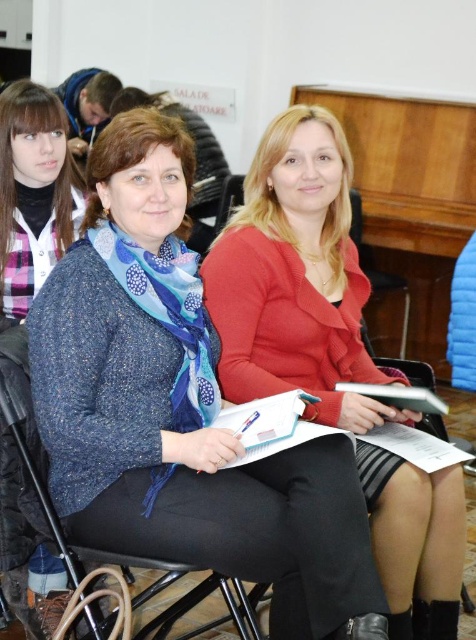
Question: Which is farther from the matte red sweater at center?

Choices:
 (A) blue textured scarf at center
 (B) wooden at center

Answer: (B)

Question: Does black plastic chair at center lie behind wooden at center?

Choices:
 (A) yes
 (B) no

Answer: (B)

Question: Which point is farther to the camera?

Choices:
 (A) blue textured scarf at center
 (B) wooden at center
 (C) black plastic chair at center
 (D) matte red sweater at center

Answer: (B)

Question: Which of the following is the farthest from the observer?

Choices:
 (A) (270, 348)
 (B) (52, 176)
 (C) (366, 269)

Answer: (C)

Question: Where is matte red sweater at center located in relation to blue textured scarf at center in the image?

Choices:
 (A) above
 (B) below

Answer: (B)

Question: Does matte red sweater at center lie behind blue textured scarf at center?

Choices:
 (A) yes
 (B) no

Answer: (B)